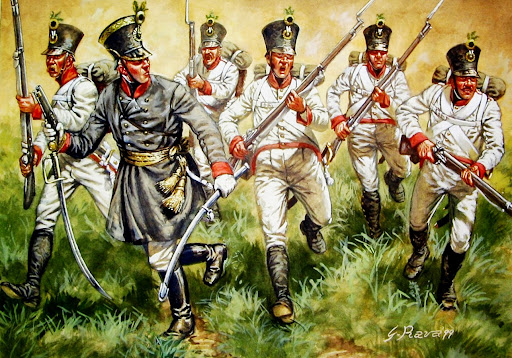
Identify the location of bedroll. (98, 68), (242, 54), (301, 63), (349, 56), (440, 72).